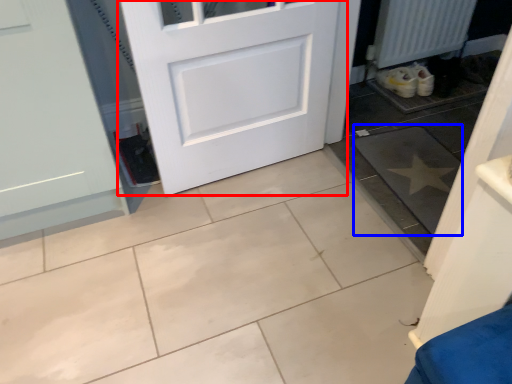
Question: Which object is closer to the camera taking this photo, door (highlighted by a red box) or ceramic tile (highlighted by a blue box)?

Choices:
 (A) door
 (B) ceramic tile

Answer: (A)